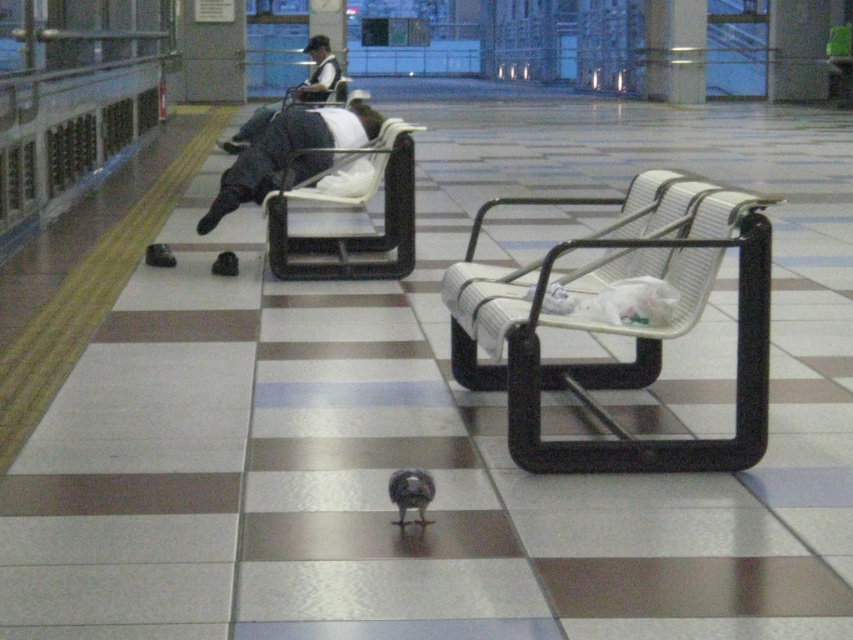
From the picture: Can you confirm if white fabric chair at center is smaller than dark gray fabric jacket at upper center?

Incorrect, white fabric chair at center is not smaller in size than dark gray fabric jacket at upper center.

What are the coordinates of `white fabric chair at center` in the screenshot? It's located at coord(355,236).

At what (x,y) coordinates should I click in order to perform the action: click on white fabric chair at center. Please return your answer as a coordinate pair (x, y). This screenshot has height=640, width=853. Looking at the image, I should click on (355, 236).

Between white woven bench at center and dark gray fabric bag at center, which one appears on the left side from the viewer's perspective?

Positioned to the left is dark gray fabric bag at center.

Which of these two, white woven bench at center or dark gray fabric bag at center, stands shorter?

With less height is dark gray fabric bag at center.

Does point (737, 237) come closer to viewer compared to point (326, 120)?

That is True.

The image size is (853, 640). What are the coordinates of `white woven bench at center` in the screenshot? It's located at (621, 324).

At what (x,y) coordinates should I click in order to perform the action: click on white fabric chair at center. Please return your answer as a coordinate pair (x, y). Looking at the image, I should click on (355, 236).

Between white fabric chair at center and gray feathered pigeon at center, which one has less height?

Standing shorter between the two is gray feathered pigeon at center.

Is point (387, 148) positioned behind point (395, 524)?

Yes, point (387, 148) is behind point (395, 524).

Find the location of a particular element. The width and height of the screenshot is (853, 640). white fabric chair at center is located at coordinates (355, 236).